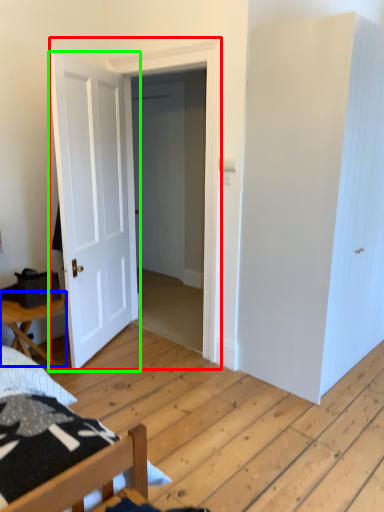
Question: Which is farther away from door (highlighted by a red box)? table (highlighted by a blue box) or door (highlighted by a green box)?

Choices:
 (A) table
 (B) door

Answer: (A)